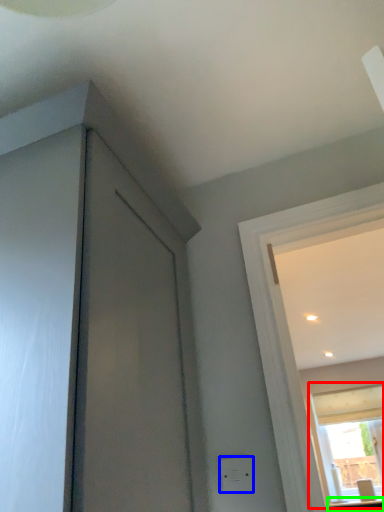
Question: Estimate the real-world distances between objects in this image. Which object is closer to window (highlighted by a red box), electric outlet (highlighted by a blue box) or counter top (highlighted by a green box)?

Choices:
 (A) electric outlet
 (B) counter top

Answer: (B)